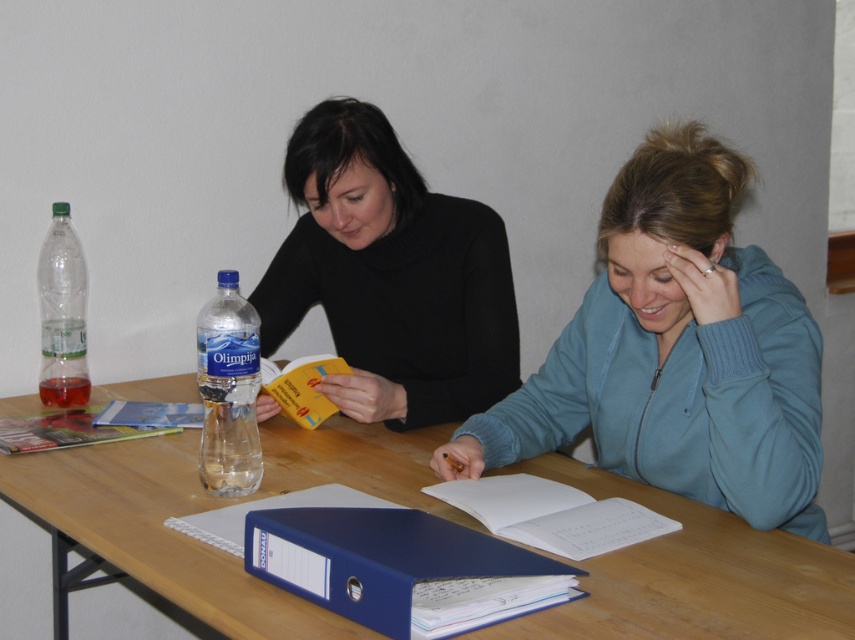
What are the coordinates of the white paper book at center?

The white paper book at center is located at coordinates point (552, 515).

You are a photographer who wants to take a closeup shot of the white paper book at center. You have a camera with a minimum focusing distance of 1 meter. Can you take the photo without moving the book or the camera?

The white paper book at center and camera are 1.17 meters apart, which is beyond the camera minimum focusing distance of 1 meter, so yes, you can take the photo without moving either.

You are organizing a coat rack for guests. There are two items to place on the rack. The blue fleece jacket at center right and the black matte sweater at upper left. According to their positions in the image, which item should be placed higher on the rack?

The black matte sweater at upper left should be placed higher on the rack since it is positioned above the blue fleece jacket at center right in the image.